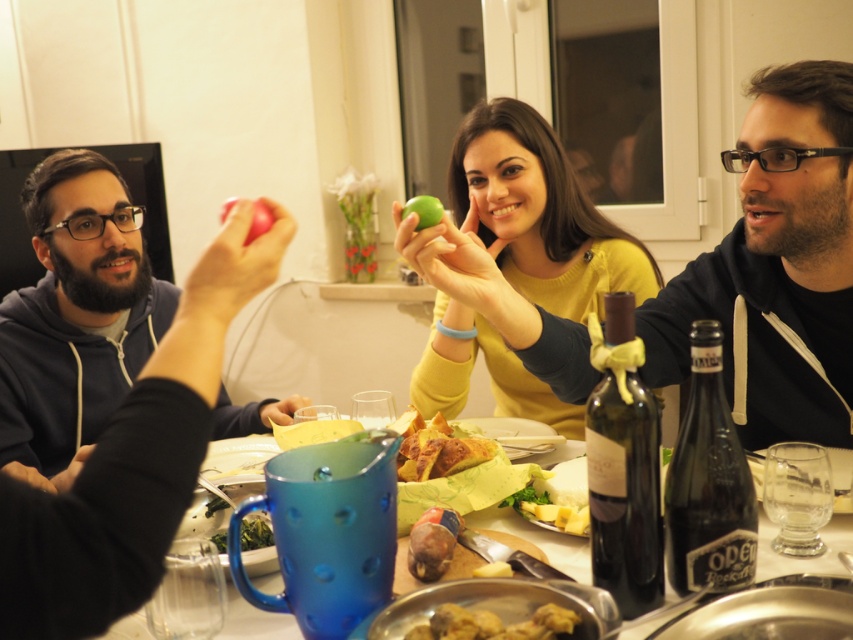
Can you confirm if matte black hoodie at center is positioned to the left of green matte apple at center?

Incorrect, matte black hoodie at center is not on the left side of green matte apple at center.

Is matte black hoodie at center to the right of green matte apple at center from the viewer's perspective?

Correct, you'll find matte black hoodie at center to the right of green matte apple at center.

Who is more distant from viewer, [807,259] or [604,276]?

The point [604,276] is more distant.

Locate an element on the screen. This screenshot has height=640, width=853. matte black hoodie at center is located at coordinates (776, 268).

Which is more to the right, green matte apple at center or matte red apple at upper center?

green matte apple at center

Who is more distant from viewer, (553, 230) or (222, 209)?

Positioned behind is point (553, 230).

This screenshot has height=640, width=853. Find the location of `green matte apple at center`. green matte apple at center is located at coordinates (538, 212).

Is golden brown meatballs at lower center below matte red apple at upper center?

Correct, golden brown meatballs at lower center is located below matte red apple at upper center.

Between golden brown meatballs at lower center and matte red apple at upper center, which one has less height?

With less height is golden brown meatballs at lower center.

Is point (410, 628) positioned after point (263, 220)?

No, (410, 628) is in front of (263, 220).

Find the location of a particular element. This screenshot has height=640, width=853. golden brown meatballs at lower center is located at coordinates (492, 625).